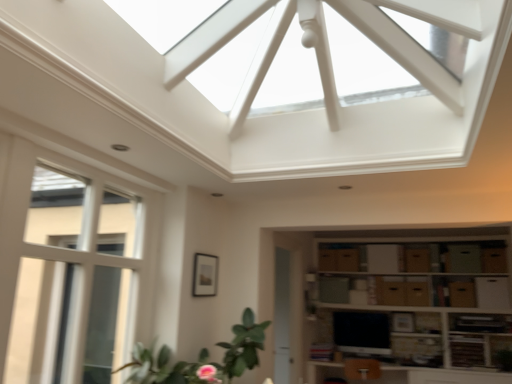
Question: Is brown cardboard drawer at lower right, the 1th drawer when ordered from right to left, turned away from matte black tv at lower center?

Choices:
 (A) yes
 (B) no

Answer: (B)

Question: Considering the relative sizes of brown cardboard drawer at lower right, the 1th drawer when ordered from right to left, and matte black tv at lower center in the image provided, is brown cardboard drawer at lower right, the 1th drawer when ordered from right to left, taller than matte black tv at lower center?

Choices:
 (A) no
 (B) yes

Answer: (A)

Question: Can you confirm if brown cardboard drawer at lower right, the 1th drawer when ordered from right to left, is thinner than matte black tv at lower center?

Choices:
 (A) yes
 (B) no

Answer: (B)

Question: Could matte black tv at lower center be considered to be inside brown cardboard drawer at lower right, the sixth drawer positioned from the left?

Choices:
 (A) yes
 (B) no

Answer: (B)

Question: From the image's perspective, does brown cardboard drawer at lower right, the 1th drawer when ordered from right to left, appear lower than matte black tv at lower center?

Choices:
 (A) no
 (B) yes

Answer: (A)

Question: Relative to brown cardboard drawer at lower right, the 5th drawer in the left-to-right sequence, is brown cardboard drawer at lower right, the 1th drawer when ordered from right to left, in front or behind?

Choices:
 (A) front
 (B) behind

Answer: (A)

Question: Is brown cardboard drawer at lower right, the 1th drawer when ordered from right to left, spatially inside brown cardboard drawer at lower right, arranged as the second drawer when viewed from the right, or outside of it?

Choices:
 (A) inside
 (B) outside

Answer: (B)

Question: Based on their positions, is brown cardboard drawer at lower right, the sixth drawer positioned from the left, located to the left or right of brown cardboard drawer at lower right, arranged as the second drawer when viewed from the right?

Choices:
 (A) right
 (B) left

Answer: (A)

Question: From their relative heights in the image, would you say brown cardboard drawer at lower right, the 1th drawer when ordered from right to left, is taller or shorter than brown cardboard drawer at lower right, arranged as the second drawer when viewed from the right?

Choices:
 (A) short
 (B) tall

Answer: (A)

Question: Which is correct: matte black tv at lower center is inside brown cardboard drawer at lower right, the 5th drawer in the left-to-right sequence, or outside of it?

Choices:
 (A) outside
 (B) inside

Answer: (A)

Question: In terms of width, does matte black tv at lower center look wider or thinner when compared to brown cardboard drawer at lower right, arranged as the second drawer when viewed from the right?

Choices:
 (A) thin
 (B) wide

Answer: (A)

Question: Relative to brown cardboard drawer at lower right, the 5th drawer in the left-to-right sequence, is matte black tv at lower center in front or behind?

Choices:
 (A) behind
 (B) front

Answer: (A)

Question: From the image's perspective, is matte black tv at lower center located above or below brown cardboard drawer at lower right, the 5th drawer in the left-to-right sequence?

Choices:
 (A) below
 (B) above

Answer: (A)

Question: From the image's perspective, relative to brown cardboard drawer at lower right, the sixth drawer positioned from the left, is brown cardboard boxes at lower right above or below?

Choices:
 (A) below
 (B) above

Answer: (A)

Question: Considering the positions of point (317, 342) and point (485, 249), is point (317, 342) closer or farther from the camera than point (485, 249)?

Choices:
 (A) farther
 (B) closer

Answer: (A)